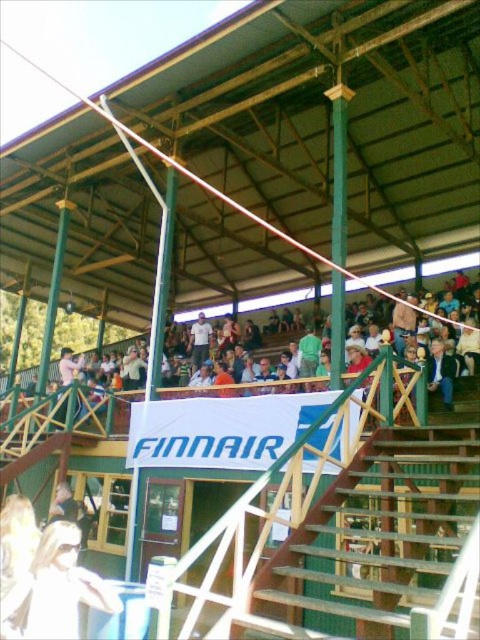
You are a photographer trying to capture a clear shot of the white cotton shirt at upper center without the green wooden pole at center blocking it. Based on their sizes, which object should you focus on to ensure the pole doesn

The green wooden pole at center is larger than the white cotton shirt at upper center. To avoid the pole blocking the shirt, focus on the white cotton shirt at upper center and position yourself so the pole is out of frame or behind it.

You are a photographer positioned at the back of the stadium bleachers. You want to take a photo of the white cotton shirt at upper center but notice the green wooden pole at center might block your view. Based on the scene description, will the pole obstruct the shirt in your photo?

The green wooden pole at center is in front of the white cotton shirt at upper center, so it will block the view of the shirt in the photo.

Based on the photo, you are a photographer at the stadium event and want to capture a photo that includes both the blonde hair at lower left and the white cotton shirt at upper center. Which object should you focus on first to ensure both are in frame?

You should focus on the blonde hair at lower left first because its width is larger than the white cotton shirt at upper center, making it easier to frame both in the photo.